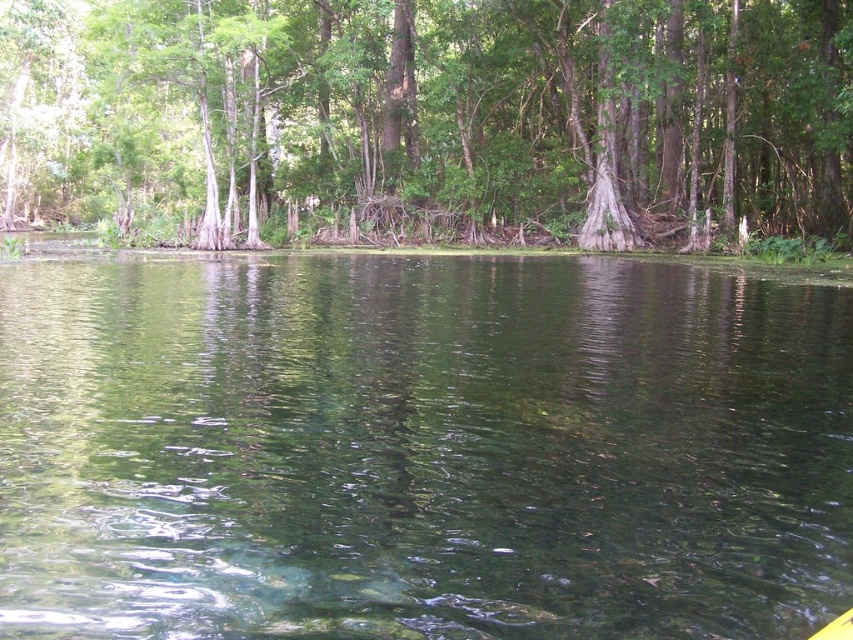
Question: Is clear water at center wider than green leafy tree at upper center?

Choices:
 (A) no
 (B) yes

Answer: (A)

Question: Can you confirm if clear water at center is positioned to the left of green leafy tree at upper center?

Choices:
 (A) yes
 (B) no

Answer: (B)

Question: Among these points, which one is farthest from the camera?

Choices:
 (A) (759, 570)
 (B) (537, 100)

Answer: (B)

Question: Which of the following is the farthest from the observer?

Choices:
 (A) (91, 433)
 (B) (619, 22)

Answer: (B)

Question: Among these objects, which one is farthest from the camera?

Choices:
 (A) green leafy tree at upper center
 (B) clear water at center

Answer: (A)

Question: Is clear water at center in front of green leafy tree at upper center?

Choices:
 (A) yes
 (B) no

Answer: (A)